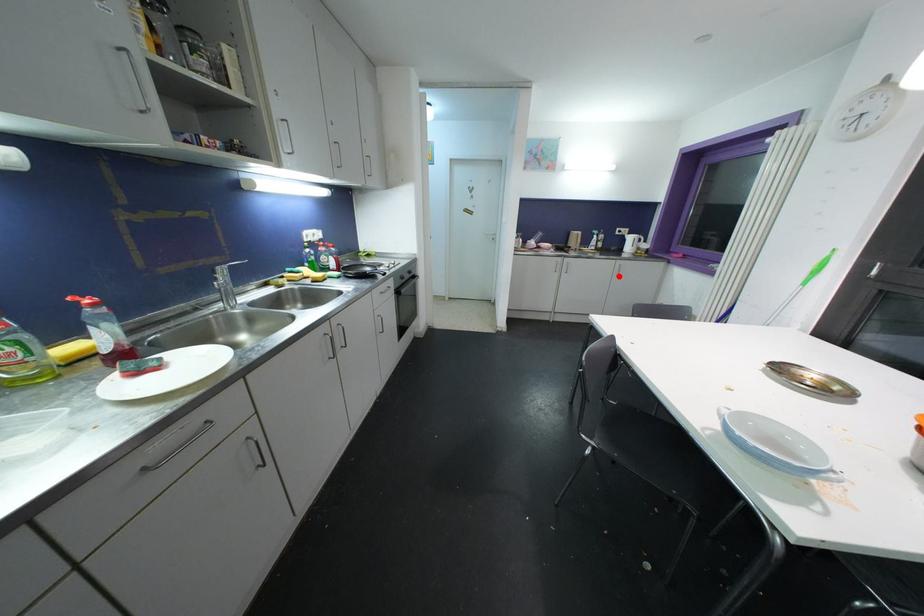
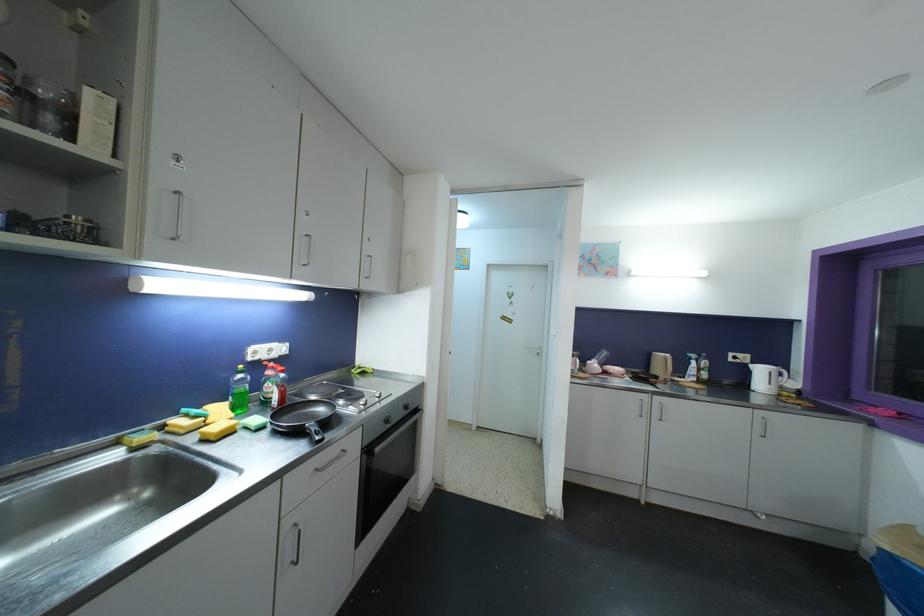
The point at the highlighted location is marked in the first image. Where is the corresponding point in the second image?

(760, 435)